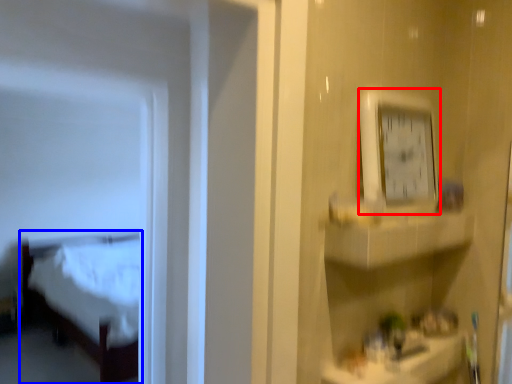
Question: Which of the following is the closest to the observer, clock (highlighted by a red box) or furniture (highlighted by a blue box)?

Choices:
 (A) clock
 (B) furniture

Answer: (A)